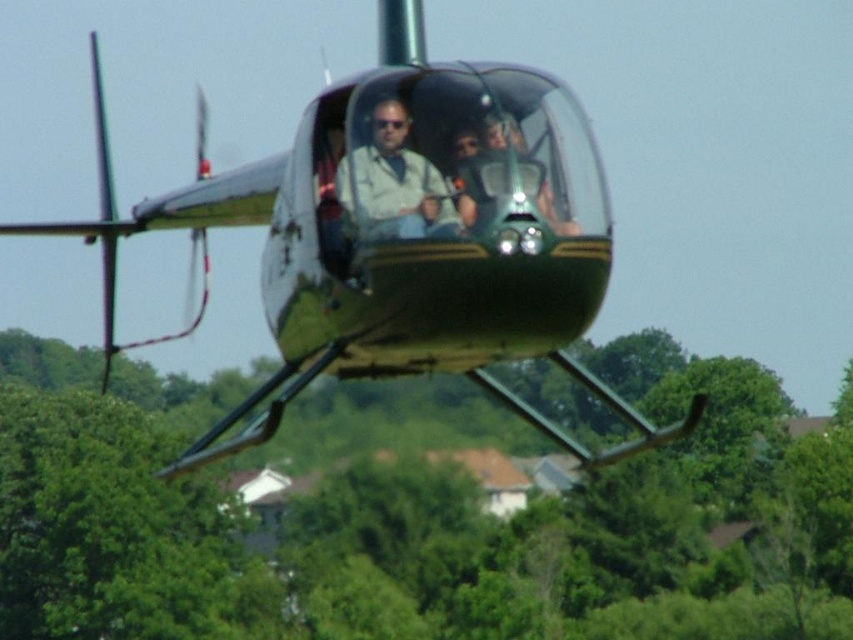
Between metallic green helicopter at center and matte beige shirt at center, which one has more height?

Standing taller between the two is metallic green helicopter at center.

What do you see at coordinates (407, 234) in the screenshot? This screenshot has height=640, width=853. I see `metallic green helicopter at center` at bounding box center [407, 234].

Find the location of `metallic green helicopter at center`. metallic green helicopter at center is located at coordinates [407, 234].

Locate an element on the screen. This screenshot has height=640, width=853. metallic green helicopter at center is located at coordinates (407, 234).